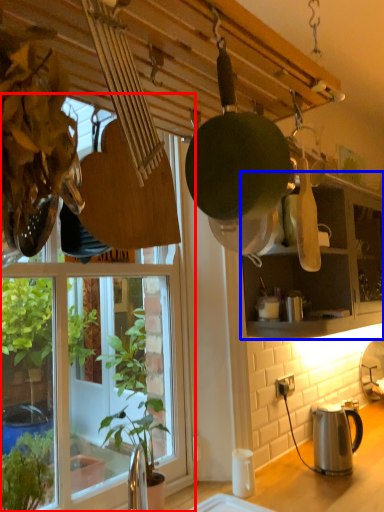
Question: Which point is further to the camera, window (highlighted by a red box) or cabinetry (highlighted by a blue box)?

Choices:
 (A) window
 (B) cabinetry

Answer: (B)